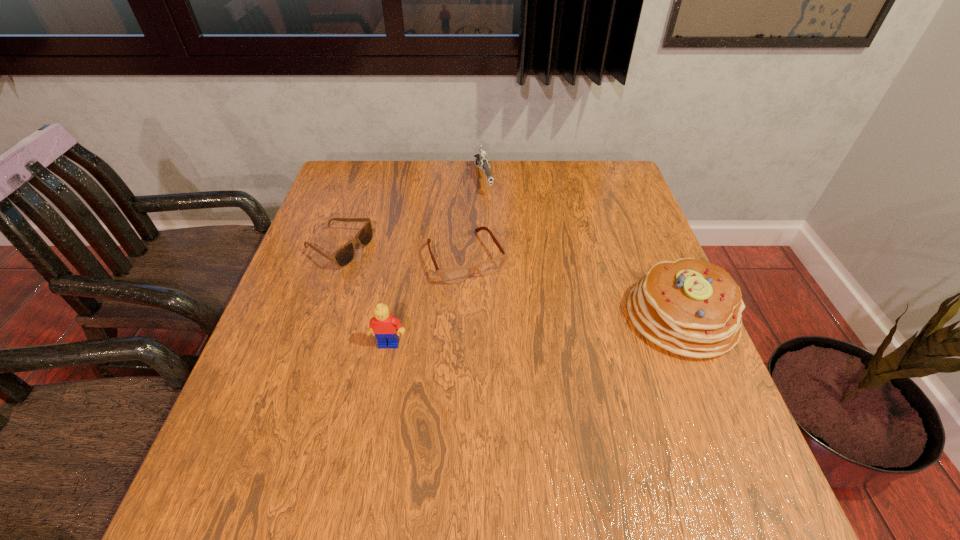
Where is `free spot on the desktop that is between the Lego and the pancake and is positioned aimed along the barrel of the third tallest object`? free spot on the desktop that is between the Lego and the pancake and is positioned aimed along the barrel of the third tallest object is located at coordinates (536, 330).

Locate an element on the screen. vacant space on the desktop that is between the Lego and the pancake and is positioned on the front-facing side of the spectacles is located at coordinates (504, 333).

Where is `vacant space on the desktop that is between the fourth object from right to left and the pancake and is positioned on the frames of the sunglasses`? vacant space on the desktop that is between the fourth object from right to left and the pancake and is positioned on the frames of the sunglasses is located at coordinates (566, 327).